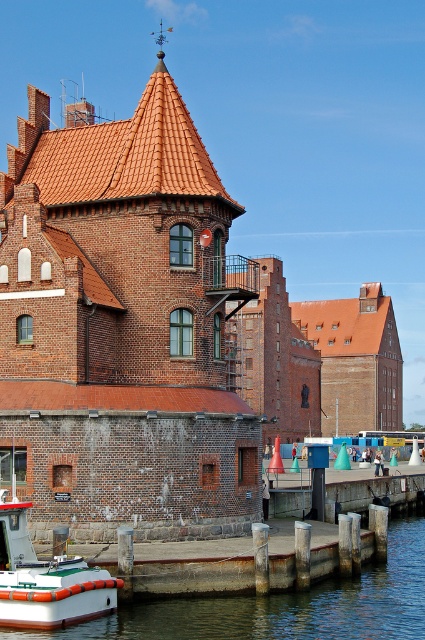
You are standing on the dock and see the smooth concrete water at lower left and the white rubber boat at lower left. Which object is taller from your viewpoint?

The smooth concrete water at lower left is taller than the white rubber boat at lower left according to the description.

You are standing on the dock and looking at the two points marked on the image. Which point is closer to you, point [181,618] or point [90,576]?

Point [90,576] is closer to you because it is less further to the camera than point [181,618].

You are standing at the camera position in the waterfront scene. You want to throw a stone into the smooth concrete water at lower left. Can you reach the water with your throw if your maximum throwing distance is 30 meters?

The distance between the camera and the smooth concrete water at lower left is 35.79 meters, which is beyond your maximum throwing distance of 30 meters. Therefore, you cannot reach the water with your throw.